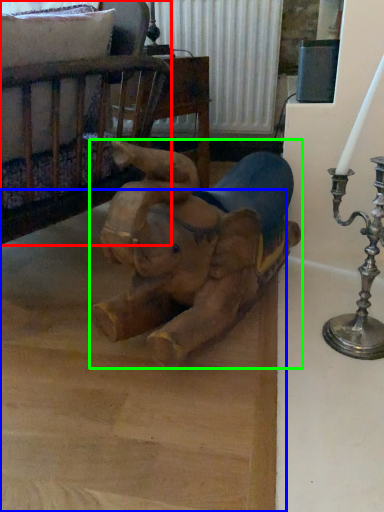
Question: Estimate the real-world distances between objects in this image. Which object is closer to furniture (highlighted by a red box), cardboard (highlighted by a blue box) or toy (highlighted by a green box)?

Choices:
 (A) cardboard
 (B) toy

Answer: (B)